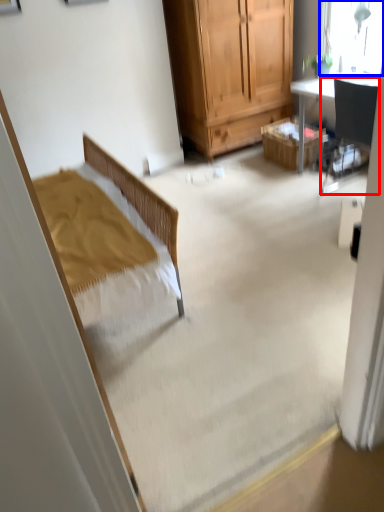
Question: Which object appears farthest to the camera in this image, chair (highlighted by a red box) or window (highlighted by a blue box)?

Choices:
 (A) chair
 (B) window

Answer: (B)